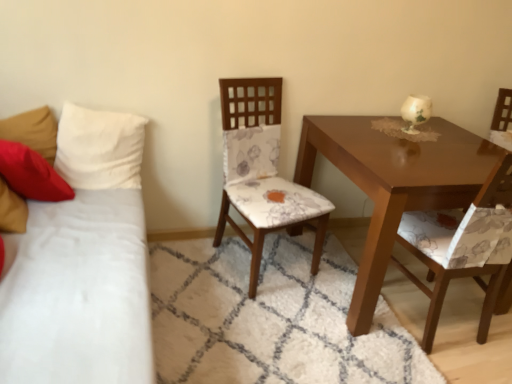
Question: Is white fabric pillow at left, which is the second pillow from left to right, aimed at floral fabric chair at center, marked as the second chair in a right-to-left arrangement?

Choices:
 (A) no
 (B) yes

Answer: (A)

Question: From a real-world perspective, is white fabric pillow at left, which is the second pillow from left to right, physically above floral fabric chair at center, the first chair viewed from the left?

Choices:
 (A) no
 (B) yes

Answer: (B)

Question: Is white fabric pillow at left, which is the second pillow from left to right, with floral fabric chair at center, marked as the second chair in a right-to-left arrangement?

Choices:
 (A) no
 (B) yes

Answer: (A)

Question: From a real-world perspective, is white fabric pillow at left, which is the second pillow from left to right, below floral fabric chair at center, the first chair viewed from the left?

Choices:
 (A) yes
 (B) no

Answer: (B)

Question: Is white fabric pillow at left, which is the 1th pillow in right-to-left order, looking in the opposite direction of floral fabric chair at center, the first chair viewed from the left?

Choices:
 (A) yes
 (B) no

Answer: (B)

Question: Is point (228, 142) closer or farther from the camera than point (96, 150)?

Choices:
 (A) farther
 (B) closer

Answer: (A)

Question: Is floral fabric chair at center, marked as the second chair in a right-to-left arrangement, spatially inside white fabric pillow at left, which is the 1th pillow in right-to-left order, or outside of it?

Choices:
 (A) outside
 (B) inside

Answer: (A)

Question: Is floral fabric chair at center, the first chair viewed from the left, bigger or smaller than white fabric pillow at left, which is the 1th pillow in right-to-left order?

Choices:
 (A) big
 (B) small

Answer: (A)

Question: Is floral fabric chair at center, marked as the second chair in a right-to-left arrangement, taller or shorter than white fabric pillow at left, which is the 1th pillow in right-to-left order?

Choices:
 (A) short
 (B) tall

Answer: (B)

Question: Considering their positions, is velvety red pillow at left, placed as the first pillow when sorted from left to right, located in front of or behind white fabric pillow at left, which is the 1th pillow in right-to-left order?

Choices:
 (A) behind
 (B) front

Answer: (A)

Question: Is point (x=19, y=183) positioned closer to the camera than point (x=59, y=117)?

Choices:
 (A) farther
 (B) closer

Answer: (B)

Question: Which is correct: velvety red pillow at left, which is the second pillow in right-to-left order, is inside white fabric pillow at left, which is the 1th pillow in right-to-left order, or outside of it?

Choices:
 (A) inside
 (B) outside

Answer: (B)

Question: From a real-world perspective, relative to white fabric pillow at left, which is the second pillow from left to right, is velvety red pillow at left, which is the second pillow in right-to-left order, vertically above or below?

Choices:
 (A) below
 (B) above

Answer: (A)

Question: In terms of height, does floral fabric chair at center, the first chair viewed from the left, look taller or shorter compared to glossy wood table at center right?

Choices:
 (A) tall
 (B) short

Answer: (A)

Question: Is floral fabric chair at center, the first chair viewed from the left, inside the boundaries of glossy wood table at center right, or outside?

Choices:
 (A) outside
 (B) inside

Answer: (A)